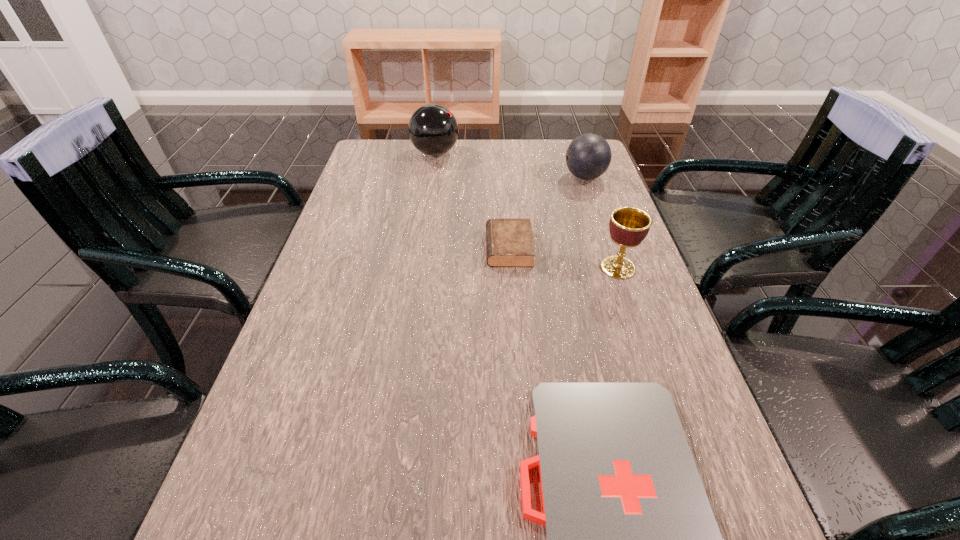
This screenshot has width=960, height=540. I want to click on vacant region that satisfies the following two spatial constraints: 1. on the spine side of the chalice; 2. on the right side of the diary, so click(x=511, y=268).

The height and width of the screenshot is (540, 960). Find the location of `vacant region that satisfies the following two spatial constraints: 1. on the grip area of the second farthest object; 2. on the back side of the chalice`. vacant region that satisfies the following two spatial constraints: 1. on the grip area of the second farthest object; 2. on the back side of the chalice is located at coordinates (615, 268).

Where is `free space that satisfies the following two spatial constraints: 1. on the back side of the chalice; 2. on the surface of the taller bowling ball near the finger holes`? free space that satisfies the following two spatial constraints: 1. on the back side of the chalice; 2. on the surface of the taller bowling ball near the finger holes is located at coordinates (579, 153).

What are the coordinates of `free space that satisfies the following two spatial constraints: 1. on the surface of the chalice near the finger holes; 2. on the right side of the taller bowling ball` in the screenshot? It's located at (418, 268).

Find the location of a particular element. This screenshot has width=960, height=540. free point that satisfies the following two spatial constraints: 1. on the back side of the chalice; 2. on the grip area of the shorter bowling ball is located at coordinates (587, 177).

In order to click on free location that satisfies the following two spatial constraints: 1. on the spine side of the fourth tallest object; 2. on the back side of the chalice in this screenshot , I will do `click(511, 268)`.